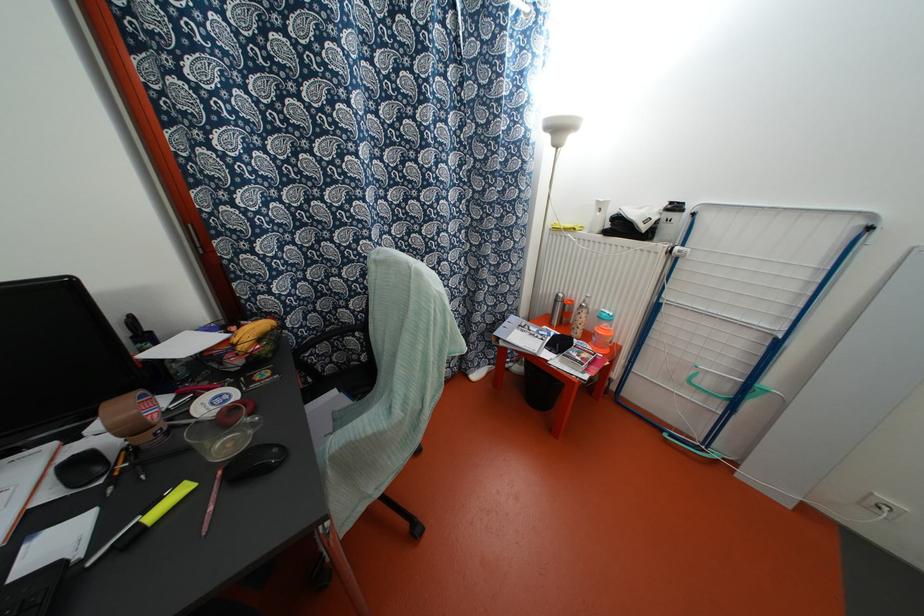
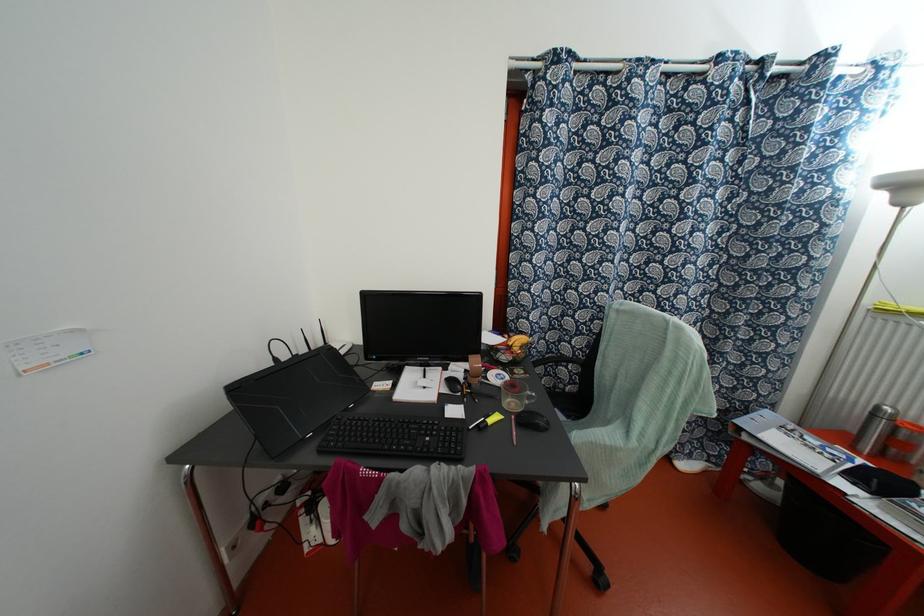
In the second image, find the point that corresponds to pixel 152 515 in the first image.

(489, 421)